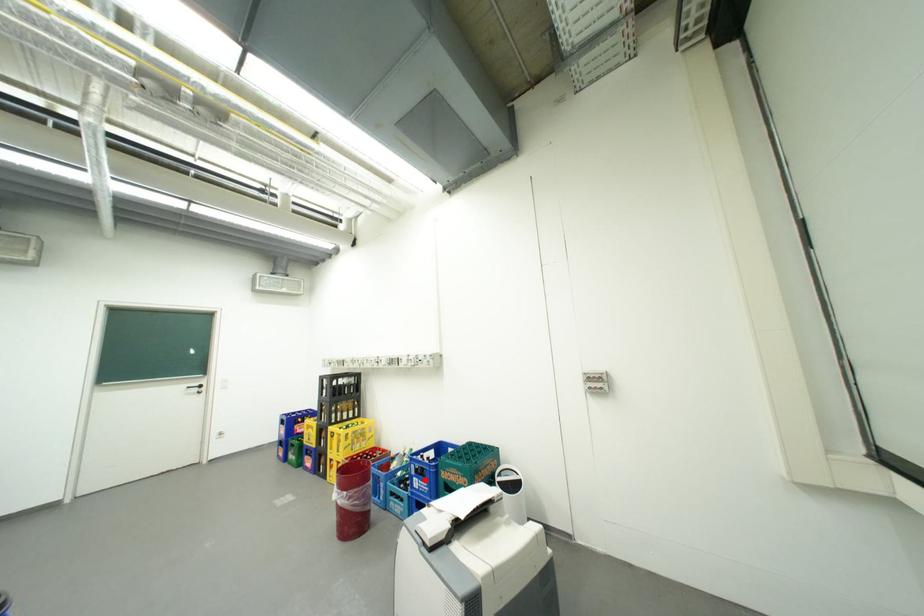
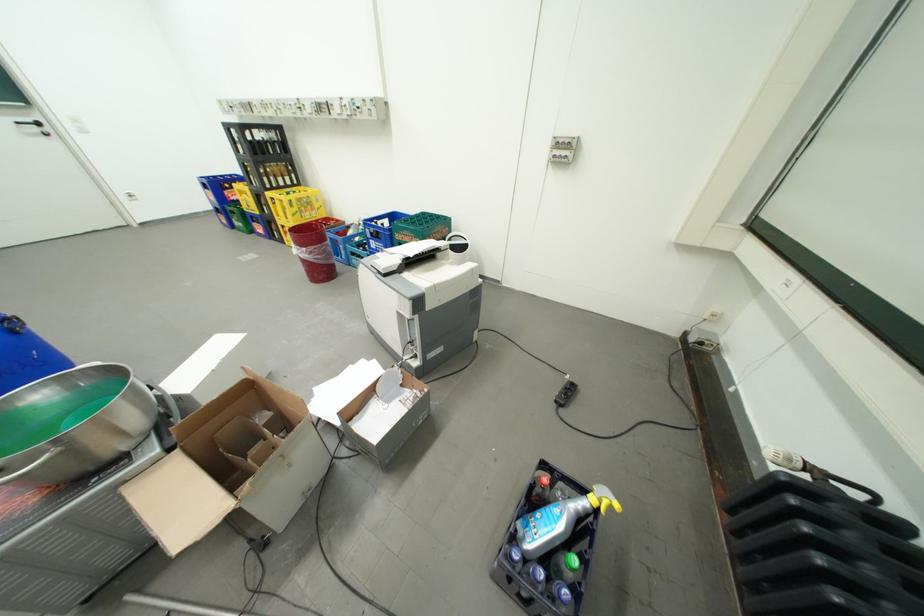
In the second image, find the point that corresponds to the highlighted location in the first image.

(381, 241)